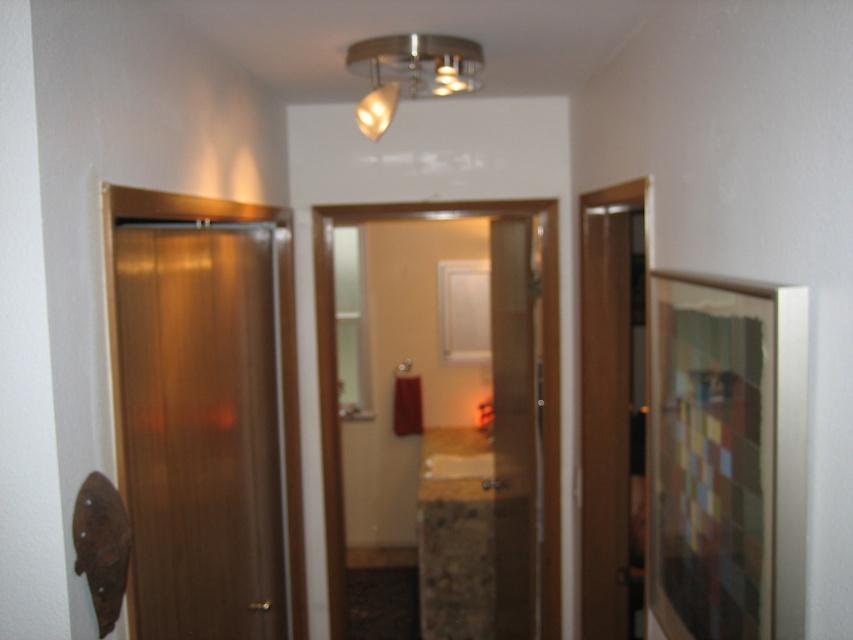
Between translucent glass elevator at center and satin nickel light fixture at upper center, which one is positioned higher?

Positioned higher is satin nickel light fixture at upper center.

Is translucent glass elevator at center shorter than satin nickel light fixture at upper center?

No.

Find the location of a particular element. translucent glass elevator at center is located at coordinates (335, 392).

Does matte brown door at left lie behind translucent glass door at center?

No, it is not.

What do you see at coordinates (200, 428) in the screenshot? I see `matte brown door at left` at bounding box center [200, 428].

Who is more forward, (x=140, y=342) or (x=519, y=256)?

Positioned in front is point (x=140, y=342).

Where is `matte brown door at left`? The height and width of the screenshot is (640, 853). matte brown door at left is located at coordinates (200, 428).

Measure the distance from translucent glass elevator at center to translucent glass door at center.

They are 16.43 inches apart.

The image size is (853, 640). In order to click on translucent glass elevator at center in this screenshot , I will do `click(335, 392)`.

The height and width of the screenshot is (640, 853). I want to click on translucent glass elevator at center, so click(x=335, y=392).